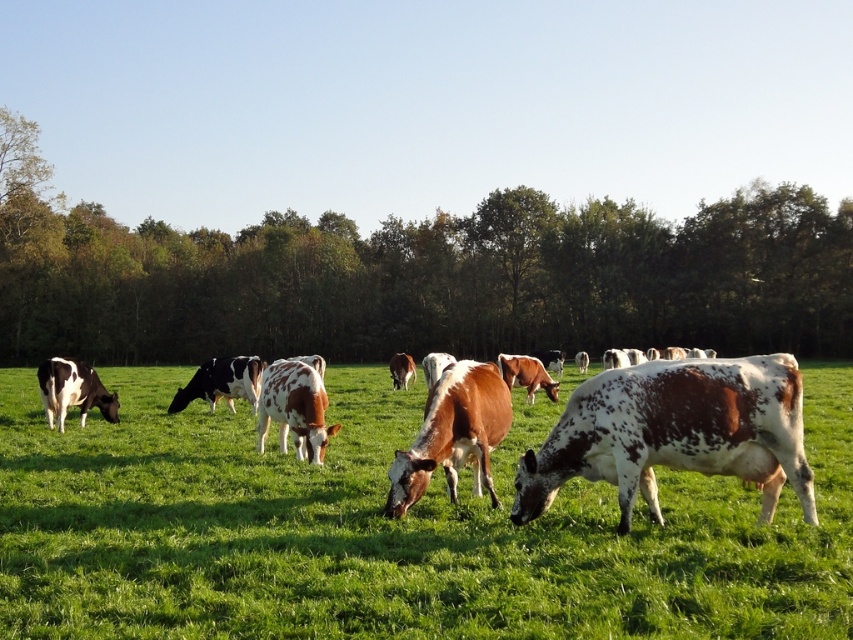
You are standing in the field and see the green grassy field at center and the black and white spotted cow at center. Which object is located to the right of the other?

The green grassy field at center is to the right of the black and white spotted cow at center according to the description.

You are a photographer trying to capture a closeup of the black and white spotted cow at center. You are currently standing on the green grassy field at center. Can you easily see the cow from your current position?

The green grassy field at center is not as tall as the black and white spotted cow at center, so yes, you can easily see the cow from your current position because the grass is shorter than the cow.